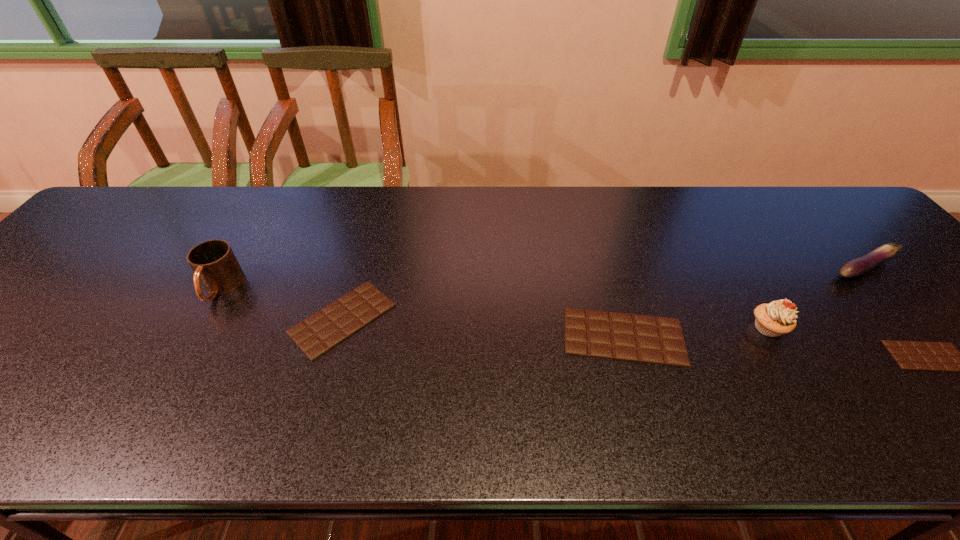
You are a GUI agent. You are given a task and a screenshot of the screen. Output one action in this format:
    pyautogui.click(x=<x>, y=<y>)
    Task: Click on the vacant area located 0.150m on the left of the third tallest object
    The image size is (960, 540).
    Given the screenshot: What is the action you would take?
    click(x=769, y=268)

The width and height of the screenshot is (960, 540). Find the location of `object located at the near edge`. object located at the near edge is located at coordinates (599, 334).

Image resolution: width=960 pixels, height=540 pixels. What are the coordinates of `object that is positioned at the right edge` in the screenshot? It's located at (859, 266).

Image resolution: width=960 pixels, height=540 pixels. What are the coordinates of `vacant region at the far edge of the desktop` in the screenshot? It's located at (660, 205).

Find the location of a particular element. The width and height of the screenshot is (960, 540). vacant space at the near edge of the desktop is located at coordinates (268, 363).

This screenshot has width=960, height=540. Find the location of `free region at the left edge`. free region at the left edge is located at coordinates (72, 290).

This screenshot has width=960, height=540. In the image, there is a desktop. In order to click on vacant space at the far left corner in this screenshot , I will do `click(121, 217)`.

In the image, there is a desktop. Where is `vacant area at the far right corner`? This screenshot has height=540, width=960. vacant area at the far right corner is located at coordinates (782, 187).

Locate an element on the screen. The image size is (960, 540). vacant space that is in between the fourth object from right to left and the fourth shortest object is located at coordinates (744, 302).

The width and height of the screenshot is (960, 540). I want to click on free space between the fourth shortest object and the second tallest chocolate bar, so click(604, 294).